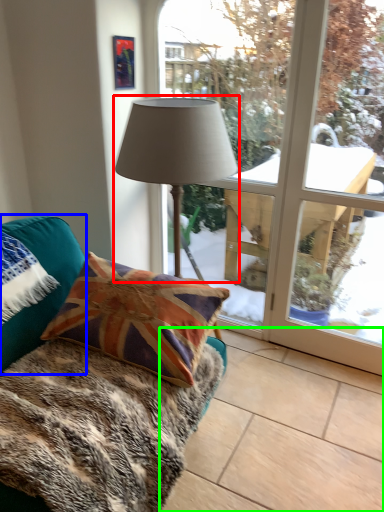
Question: Estimate the real-world distances between objects in this image. Which object is closer to lamp (highlighted by a red box), pillow (highlighted by a blue box) or tile (highlighted by a green box)?

Choices:
 (A) pillow
 (B) tile

Answer: (A)